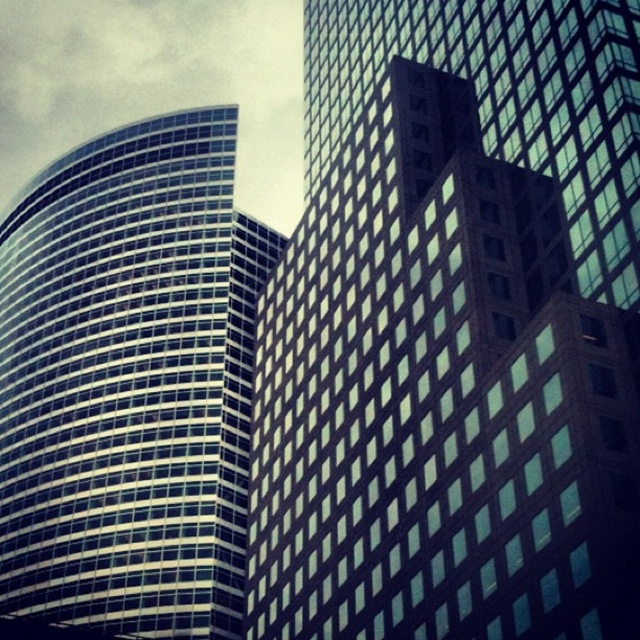
Is glassy reflective skyscraper at center above glassy reflective skyscraper at left?

Correct, glassy reflective skyscraper at center is located above glassy reflective skyscraper at left.

From the picture: Which of these two, glassy reflective skyscraper at center or glassy reflective skyscraper at left, stands taller?

glassy reflective skyscraper at left is taller.

Is point (525, 228) positioned before point (3, 262)?

That is True.

Identify the location of glassy reflective skyscraper at center. point(454,332).